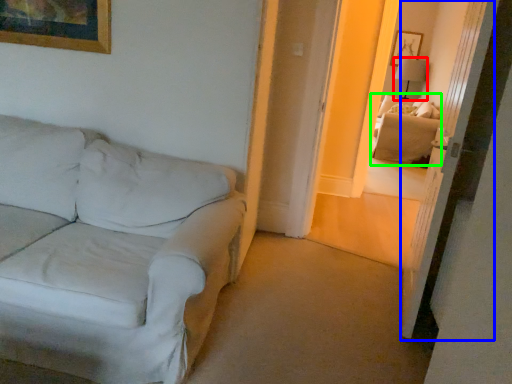
Question: Based on their relative distances, which object is nearer to table lamp (highlighted by a red box)? Choose from glass door (highlighted by a blue box) and couch (highlighted by a green box).

Choices:
 (A) glass door
 (B) couch

Answer: (B)